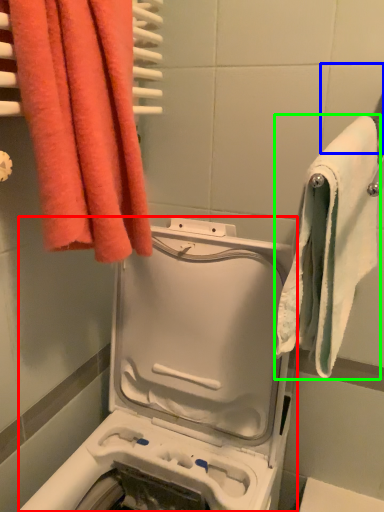
Question: Estimate the real-world distances between objects in this image. Which object is farther from washing machine (highlighted by a red box), tile (highlighted by a blue box) or towel (highlighted by a green box)?

Choices:
 (A) tile
 (B) towel

Answer: (A)